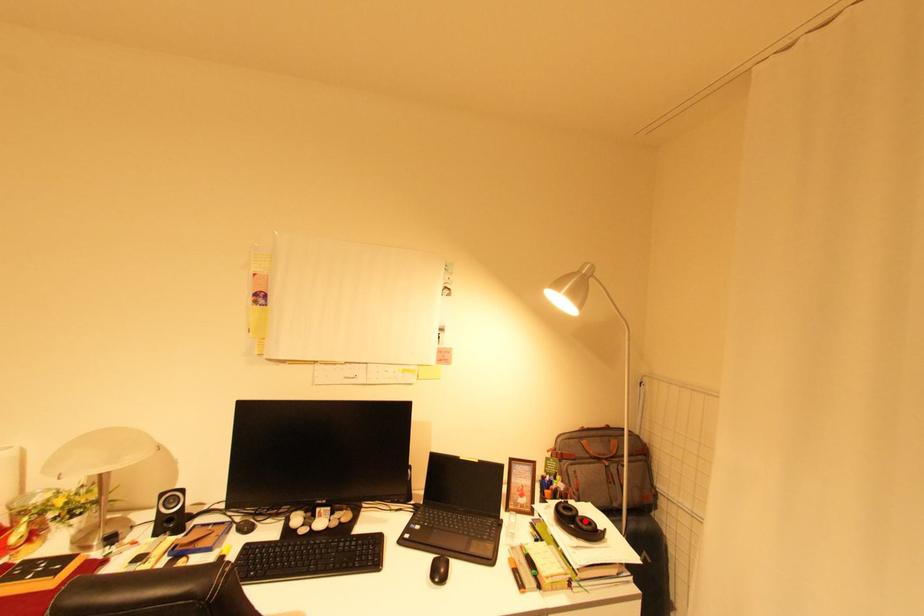
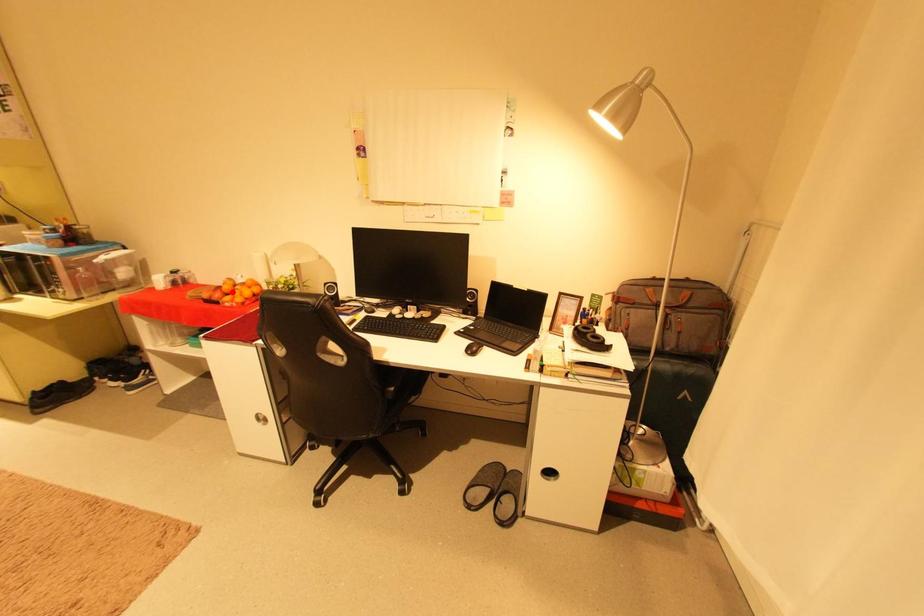
Looking at this image, I am providing you with two images of the same scene from different viewpoints. A red point is marked on the first image and another point is marked on the second image. Are the points marked in image1 and image2 representing the same 3D position?

No